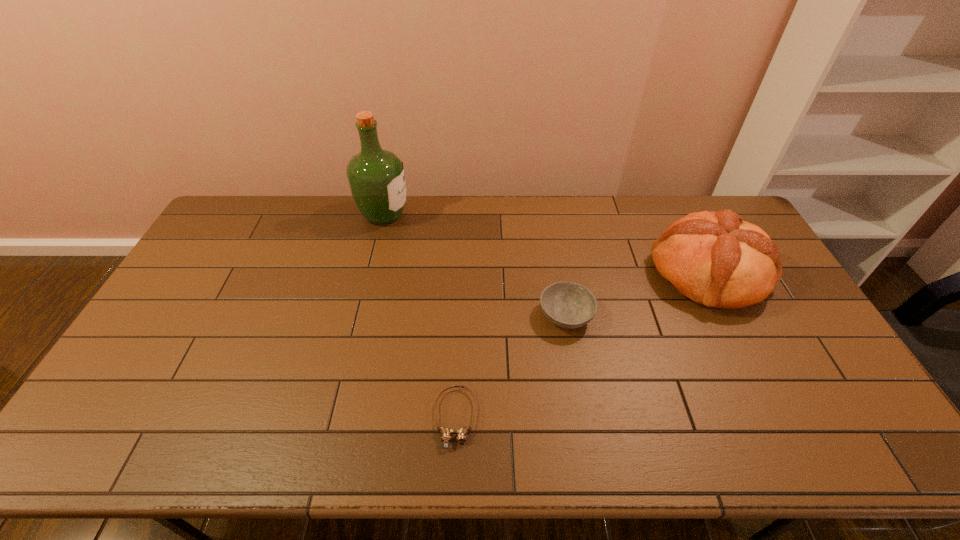
The image size is (960, 540). I want to click on liquor, so (x=376, y=177).

In order to click on the tallest object in this screenshot , I will do [376, 177].

Image resolution: width=960 pixels, height=540 pixels. Identify the location of the second tallest object. (716, 259).

Locate an element on the screen. The width and height of the screenshot is (960, 540). the rightmost object is located at coordinates (716, 259).

In order to click on the third tallest object in this screenshot , I will do `click(569, 305)`.

This screenshot has width=960, height=540. Find the location of `the second object from right to left`. the second object from right to left is located at coordinates (569, 305).

You are a GUI agent. You are given a task and a screenshot of the screen. Output one action in this format:
    pyautogui.click(x=<x>, y=<y>)
    Task: Click on the shortest object
    Image resolution: width=960 pixels, height=540 pixels.
    Given the screenshot: What is the action you would take?
    pyautogui.click(x=446, y=433)

Where is `the third object from right to left`? The height and width of the screenshot is (540, 960). the third object from right to left is located at coordinates (446, 433).

The height and width of the screenshot is (540, 960). What are the coordinates of `vacant space situated on the front-facing side of the liquor` in the screenshot? It's located at (450, 214).

This screenshot has width=960, height=540. Identify the location of free region located on the left of the rightmost object. (620, 273).